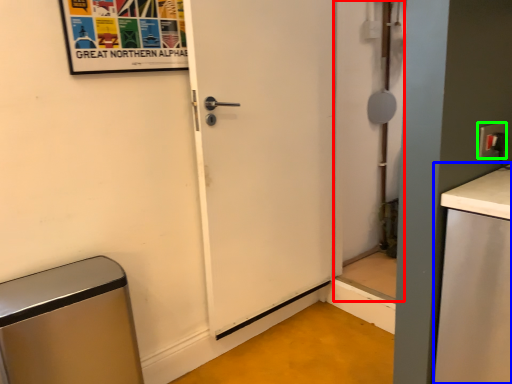
Question: Estimate the real-world distances between objects in this image. Which object is farther from screen door (highlighted by a red box), counter top (highlighted by a blue box) or electric outlet (highlighted by a green box)?

Choices:
 (A) counter top
 (B) electric outlet

Answer: (B)